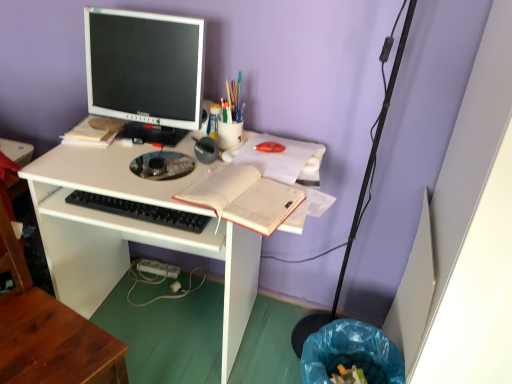
Question: Choose the correct answer: Is white paper notebook at center inside white plastic power plugs and sockets at lower center or outside it?

Choices:
 (A) outside
 (B) inside

Answer: (A)

Question: Considering the relative positions of white paper notebook at center and white plastic power plugs and sockets at lower center in the image provided, is white paper notebook at center to the left or to the right of white plastic power plugs and sockets at lower center?

Choices:
 (A) left
 (B) right

Answer: (B)

Question: Which of these objects is positioned farthest from the translucent plastic cup at upper center, which is the third stationery in front-to-back order?

Choices:
 (A) white paper notebook at center
 (B) matte plastic cup at upper center, which appears as the second stationery when viewed from the front
 (C) wooden at left
 (D) blue plastic trash can at lower right
 (E) satin black monitor at upper left

Answer: (D)

Question: Estimate the real-world distances between objects in this image. Which object is closer to the satin black monitor at upper left?

Choices:
 (A) black plastic keyboard at center
 (B) blue plastic trash can at lower right
 (C) wooden at left
 (D) metallic gray pen at center, marked as the third stationery in a back-to-front arrangement
 (E) translucent plastic cup at upper center, which is the third stationery in front-to-back order

Answer: (E)